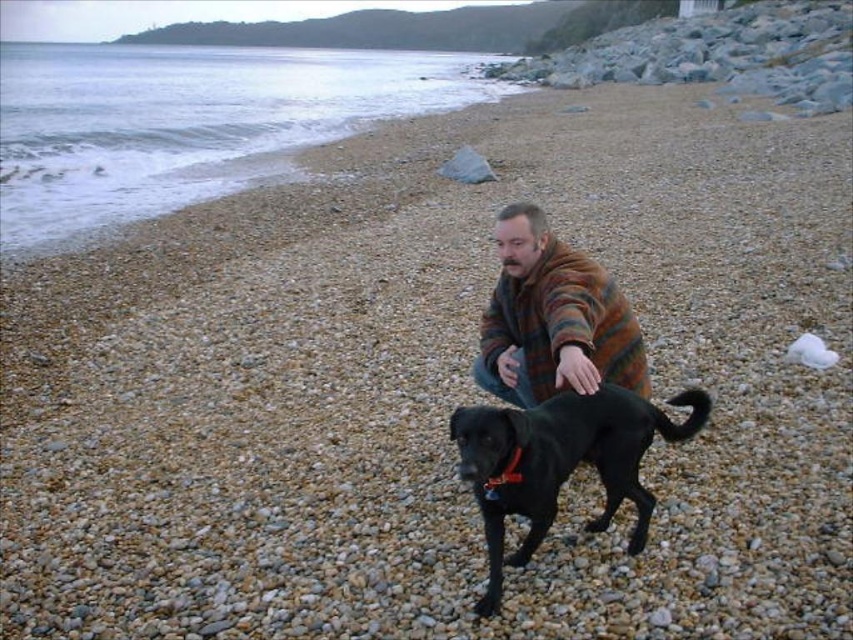
You are standing on the beach and want to walk towards the black matte dog at center. Which direction should you move relative to the smooth sand at lower left?

You should move away from the smooth sand at lower left because the black matte dog at center is behind it.

You are a photographer trying to capture the black matte dog at center and the smooth sand at lower left in the same frame. Based on their sizes, which one would appear larger in the photo?

The smooth sand at lower left would appear larger in the photo because its width is larger than the black matte dog at center.